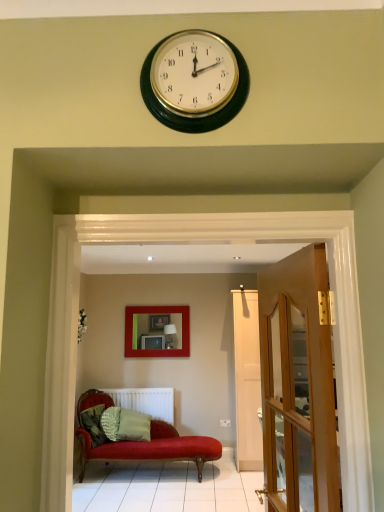
This screenshot has height=512, width=384. What do you see at coordinates (146, 401) in the screenshot?
I see `white matte radiator at lower center` at bounding box center [146, 401].

This screenshot has width=384, height=512. I want to click on matte red picture frame at center, so click(x=157, y=312).

I want to click on green textured pillow at lower left, the 1th pillow in the left-to-right sequence, so click(x=93, y=424).

Locate an element on the screen. This screenshot has width=384, height=512. white matte radiator at lower center is located at coordinates (146, 401).

Does green textured pillow at center, the first pillow viewed from the right, contain wooden glass door at right?

Definitely not — wooden glass door at right is not inside green textured pillow at center, the first pillow viewed from the right.

Who is taller, green textured pillow at center, positioned as the 2th pillow in left-to-right order, or wooden glass door at right?

wooden glass door at right is taller.

Are green textured pillow at center, the first pillow viewed from the right, and wooden glass door at right far apart?

That's right, there is a large distance between green textured pillow at center, the first pillow viewed from the right, and wooden glass door at right.

Which of these two, white matte radiator at lower center or green textured pillow at lower left, which is the second pillow in right-to-left order, stands taller?

Standing taller between the two is white matte radiator at lower center.

At what (x,y) coordinates should I click in order to perform the action: click on radiator that appears behind the green textured pillow at lower left, the 1th pillow in the left-to-right sequence. Please return your answer as a coordinate pair (x, y). This screenshot has width=384, height=512. Looking at the image, I should click on (146, 401).

Is green textured pillow at lower left, which is the second pillow in right-to-left order, a part of white matte radiator at lower center?

That's incorrect, green textured pillow at lower left, which is the second pillow in right-to-left order, is not inside white matte radiator at lower center.

Is white matte radiator at lower center next to green textured pillow at lower left, which is the second pillow in right-to-left order, and touching it?

No, white matte radiator at lower center is not next to green textured pillow at lower left, which is the second pillow in right-to-left order.

From a real-world perspective, relative to green textured pillow at lower left, which is the second pillow in right-to-left order, is wooden glass door at right vertically above or below?

Clearly, from a real-world perspective, wooden glass door at right is above green textured pillow at lower left, which is the second pillow in right-to-left order.

Which of these two, wooden glass door at right or green textured pillow at lower left, the 1th pillow in the left-to-right sequence, is bigger?

wooden glass door at right.

How many degrees apart are the facing directions of wooden glass door at right and green textured pillow at lower left, which is the second pillow in right-to-left order?

They differ by 161 degrees in their facing directions.

Consider the image. Would you consider wooden glass door at right to be distant from green textured pillow at lower left, the 1th pillow in the left-to-right sequence?

Yes.

Which of these two, wooden glass door at right or matte red picture frame at center, is thinner?

matte red picture frame at center is thinner.

Which is more to the left, wooden glass door at right or matte red picture frame at center?

matte red picture frame at center.

From their relative heights in the image, would you say wooden glass door at right is taller or shorter than matte red picture frame at center?

Clearly, wooden glass door at right is taller compared to matte red picture frame at center.

Is wooden glass door at right bigger or smaller than matte red picture frame at center?

wooden glass door at right is bigger than matte red picture frame at center.

Which object is thinner, green textured pillow at lower left, which is the second pillow in right-to-left order, or white matte radiator at lower center?

With smaller width is white matte radiator at lower center.

Is point (92, 445) closer to viewer compared to point (121, 393)?

That is True.

Based on their sizes in the image, would you say green textured pillow at lower left, the 1th pillow in the left-to-right sequence, is bigger or smaller than white matte radiator at lower center?

Clearly, green textured pillow at lower left, the 1th pillow in the left-to-right sequence, is smaller in size than white matte radiator at lower center.

From the image's perspective, which is above, matte red picture frame at center or wooden glass door at right?

wooden glass door at right, from the image's perspective.

From a real-world perspective, is matte red picture frame at center physically below wooden glass door at right?

No.

Based on their positions, is matte red picture frame at center located to the left or right of wooden glass door at right?

matte red picture frame at center is to the left of wooden glass door at right.

Is there a large distance between matte red picture frame at center and wooden glass door at right?

Yes.

Where is `door on the right of white matte radiator at lower center`? The height and width of the screenshot is (512, 384). door on the right of white matte radiator at lower center is located at coordinates pos(298,384).

Is white matte radiator at lower center not within wooden glass door at right?

Yes, white matte radiator at lower center is not within wooden glass door at right.

From their relative heights in the image, would you say white matte radiator at lower center is taller or shorter than wooden glass door at right?

white matte radiator at lower center is shorter than wooden glass door at right.

Find the location of a particular element. door lying on the right of green textured pillow at center, the first pillow viewed from the right is located at coordinates (298, 384).

Starting from the white matte radiator at lower center, which pillow is the 2nd one to the left? Please provide its 2D coordinates.

[(93, 424)]

When comparing their distances from white matte radiator at lower center, does green textured pillow at lower left, the 1th pillow in the left-to-right sequence, or green textured pillow at center, the first pillow viewed from the right, seem closer?

green textured pillow at center, the first pillow viewed from the right.

From the image, which object appears to be nearer to matte red picture frame at center, wooden glass door at right or white matte radiator at lower center?

white matte radiator at lower center is positioned closer to the anchor matte red picture frame at center.

Estimate the real-world distances between objects in this image. Which object is further from green textured pillow at center, positioned as the 2th pillow in left-to-right order, green textured pillow at lower left, which is the second pillow in right-to-left order, or wooden glass door at right?

wooden glass door at right is further to green textured pillow at center, positioned as the 2th pillow in left-to-right order.

Estimate the real-world distances between objects in this image. Which object is further from wooden glass door at right, green textured pillow at lower left, the 1th pillow in the left-to-right sequence, or green textured pillow at center, positioned as the 2th pillow in left-to-right order?

Based on the image, green textured pillow at center, positioned as the 2th pillow in left-to-right order, appears to be further to wooden glass door at right.

Which object lies nearer to the anchor point matte red picture frame at center, wooden glass door at right or green textured pillow at center, positioned as the 2th pillow in left-to-right order?

Based on the image, green textured pillow at center, positioned as the 2th pillow in left-to-right order, appears to be nearer to matte red picture frame at center.

Considering their positions, is green textured pillow at lower left, the 1th pillow in the left-to-right sequence, positioned further to wooden glass door at right than matte red picture frame at center?

matte red picture frame at center is further to wooden glass door at right.

Based on their spatial positions, is green textured pillow at center, the first pillow viewed from the right, or matte red picture frame at center closer to wooden glass door at right?

green textured pillow at center, the first pillow viewed from the right.

Based on their spatial positions, is wooden glass door at right or green textured pillow at lower left, which is the second pillow in right-to-left order, closer to white matte radiator at lower center?

green textured pillow at lower left, which is the second pillow in right-to-left order, is positioned closer to the anchor white matte radiator at lower center.

This screenshot has height=512, width=384. I want to click on pillow between matte red picture frame at center and green textured pillow at center, positioned as the 2th pillow in left-to-right order, in the up-down direction, so click(x=93, y=424).

I want to click on radiator located between wooden glass door at right and matte red picture frame at center in the depth direction, so click(x=146, y=401).

The height and width of the screenshot is (512, 384). I want to click on pillow between wooden glass door at right and green textured pillow at center, positioned as the 2th pillow in left-to-right order, along the z-axis, so click(x=93, y=424).

Identify the location of pillow positioned between green textured pillow at lower left, the 1th pillow in the left-to-right sequence, and white matte radiator at lower center from near to far. (125, 424).